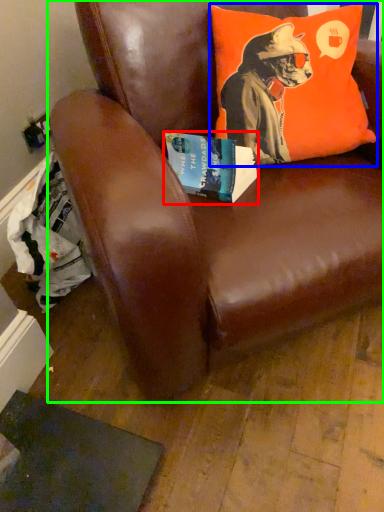
Question: Which is nearer to the book (highlighted by a red box)? pillow (highlighted by a blue box) or chair (highlighted by a green box).

Choices:
 (A) pillow
 (B) chair

Answer: (A)